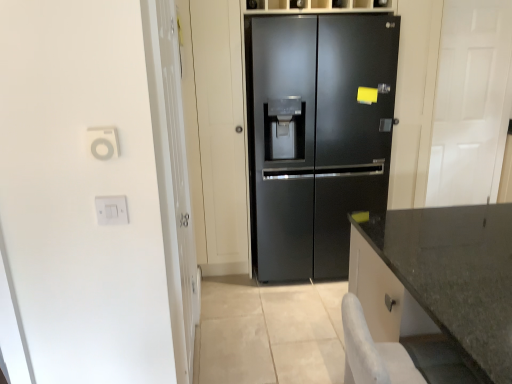
In order to face transparent glass door at left, positioned as the second glass door in back-to-front order, should I rotate leftwards or rightwards?

Turn left by 9.740 degrees to look at transparent glass door at left, positioned as the second glass door in back-to-front order.

Locate an element on the screen. This screenshot has width=512, height=384. white plastic switch at left, the second electric outlet from the top is located at coordinates (111, 210).

At what (x,y) coordinates should I click in order to perform the action: click on white plastic outlet at upper left, the 1th electric outlet from the top. Please return your answer as a coordinate pair (x, y). Looking at the image, I should click on (103, 143).

Can you tell me how much white plastic outlet at upper left, marked as the 1th electric outlet in a front-to-back arrangement, and white plastic switch at left, arranged as the 1th electric outlet when ordered from the bottom, differ in facing direction?

0.155 degrees.

Is white plastic outlet at upper left, which is counted as the 2th electric outlet, starting from the back, turned away from white plastic switch at left, the second electric outlet from the top?

No.

Is white plastic outlet at upper left, which is counted as the second electric outlet, starting from the bottom, placed right next to white plastic switch at left, placed as the first electric outlet when sorted from back to front?

white plastic outlet at upper left, which is counted as the second electric outlet, starting from the bottom, and white plastic switch at left, placed as the first electric outlet when sorted from back to front, are clearly separated.

Is white plastic outlet at upper left, which is counted as the 2th electric outlet, starting from the back, at the right side of white plastic switch at left, the second electric outlet from the top?

In fact, white plastic outlet at upper left, which is counted as the 2th electric outlet, starting from the back, is to the left of white plastic switch at left, the second electric outlet from the top.

Where is `electric outlet that is the 2nd one when counting leftward from the black matte refrigerator at center`? This screenshot has height=384, width=512. electric outlet that is the 2nd one when counting leftward from the black matte refrigerator at center is located at coordinates (103, 143).

Considering the sizes of objects white plastic outlet at upper left, the 1th electric outlet from the top, and black matte refrigerator at center in the image provided, who is shorter, white plastic outlet at upper left, the 1th electric outlet from the top, or black matte refrigerator at center?

With less height is white plastic outlet at upper left, the 1th electric outlet from the top.

Between point (116, 155) and point (343, 248), which one is positioned in front?

Positioned in front is point (116, 155).

In the scene shown: Which object is positioned more to the right, white plastic outlet at upper left, the 1th electric outlet from the top, or black matte refrigerator at center?

Positioned to the right is black matte refrigerator at center.

Consider the image. How distant is white plastic outlet at upper left, which is counted as the 2th electric outlet, starting from the back, from transparent glass door at left, which is the first glass door from front to back?

white plastic outlet at upper left, which is counted as the 2th electric outlet, starting from the back, and transparent glass door at left, which is the first glass door from front to back, are 32.80 inches apart from each other.

Is white plastic outlet at upper left, the 1th electric outlet from the top, looking in the opposite direction of transparent glass door at left, positioned as the second glass door in back-to-front order?

Correct, white plastic outlet at upper left, the 1th electric outlet from the top, is looking away from transparent glass door at left, positioned as the second glass door in back-to-front order.

Which is behind, point (98, 150) or point (160, 191)?

The point (160, 191) is more distant.

Looking at this image, is black matte refrigerator at center at the left side of granite gray countertop at lower right?

Yes, black matte refrigerator at center is to the left of granite gray countertop at lower right.

Is black matte refrigerator at center situated inside granite gray countertop at lower right or outside?

black matte refrigerator at center is outside granite gray countertop at lower right.

How different are the orientations of black matte refrigerator at center and granite gray countertop at lower right in degrees?

The angular difference between black matte refrigerator at center and granite gray countertop at lower right is 89.3 degrees.

Between black matte refrigerator at center and granite gray countertop at lower right, which one is positioned in front?

granite gray countertop at lower right.

Can you confirm if granite gray countertop at lower right is wider than transparent glass door at left, which appears as the 2th glass door when viewed from the right?

Yes.

Is granite gray countertop at lower right far away from transparent glass door at left, positioned as the second glass door in back-to-front order?

Yes, granite gray countertop at lower right and transparent glass door at left, positioned as the second glass door in back-to-front order, are located far from each other.

Starting from the granite gray countertop at lower right, which glass door is the 1st one behind? Please provide its 2D coordinates.

[(176, 189)]

Considering the sizes of objects granite gray countertop at lower right and transparent glass door at left, which is the first glass door from front to back, in the image provided, who is shorter, granite gray countertop at lower right or transparent glass door at left, which is the first glass door from front to back,?

granite gray countertop at lower right is shorter.

Does black matte refrigerator at center turn towards white plastic switch at left, placed as the first electric outlet when sorted from back to front?

No, black matte refrigerator at center is not turned towards white plastic switch at left, placed as the first electric outlet when sorted from back to front.

Is black matte refrigerator at center not near white plastic switch at left, the second electric outlet from the top?

black matte refrigerator at center is positioned a significant distance from white plastic switch at left, the second electric outlet from the top.

Which object is wider, black matte refrigerator at center or white plastic switch at left, placed as the first electric outlet when sorted from back to front?

Wider between the two is black matte refrigerator at center.

Is transparent glass door at left, positioned as the second glass door in back-to-front order, oriented towards white plastic switch at left, arranged as the second electric outlet when viewed from the front?

No, transparent glass door at left, positioned as the second glass door in back-to-front order, is not facing towards white plastic switch at left, arranged as the second electric outlet when viewed from the front.

Who is smaller, transparent glass door at left, which appears as the 2th glass door when viewed from the right, or white plastic switch at left, arranged as the second electric outlet when viewed from the front?

white plastic switch at left, arranged as the second electric outlet when viewed from the front.

In the scene shown: How different are the orientations of transparent glass door at left, positioned as the 1th glass door in left-to-right order, and white plastic switch at left, arranged as the second electric outlet when viewed from the front, in degrees?

There is a 90.8-degree angle between the facing directions of transparent glass door at left, positioned as the 1th glass door in left-to-right order, and white plastic switch at left, arranged as the second electric outlet when viewed from the front.

From a real-world perspective, is transparent glass door at left, positioned as the 1th glass door in left-to-right order, physically below white plastic switch at left, placed as the first electric outlet when sorted from back to front?

Indeed, from a real-world perspective, transparent glass door at left, positioned as the 1th glass door in left-to-right order, is positioned beneath white plastic switch at left, placed as the first electric outlet when sorted from back to front.

This screenshot has height=384, width=512. In the image, there is a white plastic switch at left, the second electric outlet from the top. What are the coordinates of `electric outlet above it (from the image's perspective)` in the screenshot? It's located at coord(103,143).

Where is `electric outlet that is the 2nd object located in front of the black matte refrigerator at center`? The image size is (512, 384). electric outlet that is the 2nd object located in front of the black matte refrigerator at center is located at coordinates [x=103, y=143].

Looking at the image, which one is located further to transparent glass door at left, which is the first glass door from front to back, white glossy door at right, arranged as the first glass door when viewed from the back, or granite gray countertop at lower right?

white glossy door at right, arranged as the first glass door when viewed from the back, is further to transparent glass door at left, which is the first glass door from front to back.

From the image, which object appears to be nearer to granite gray countertop at lower right, white glossy door at right, the 1th glass door in the right-to-left sequence, or black matte refrigerator at center?

black matte refrigerator at center is positioned closer to the anchor granite gray countertop at lower right.

Estimate the real-world distances between objects in this image. Which object is further from black matte refrigerator at center, white glossy door at right, the 1th glass door in the right-to-left sequence, or transparent glass door at left, positioned as the second glass door in back-to-front order?

white glossy door at right, the 1th glass door in the right-to-left sequence, is positioned further to the anchor black matte refrigerator at center.

In the scene shown: From the image, which object appears to be farther from white plastic switch at left, placed as the first electric outlet when sorted from back to front, white glossy door at right, the 1th glass door in the right-to-left sequence, or white plastic outlet at upper left, which is counted as the second electric outlet, starting from the bottom?

The object further to white plastic switch at left, placed as the first electric outlet when sorted from back to front, is white glossy door at right, the 1th glass door in the right-to-left sequence.

Estimate the real-world distances between objects in this image. Which object is closer to granite gray countertop at lower right, transparent glass door at left, positioned as the second glass door in back-to-front order, or white plastic outlet at upper left, which is counted as the second electric outlet, starting from the bottom?

The object closer to granite gray countertop at lower right is transparent glass door at left, positioned as the second glass door in back-to-front order.

From the picture: Considering their positions, is black matte refrigerator at center positioned closer to white plastic outlet at upper left, which is counted as the second electric outlet, starting from the bottom, than granite gray countertop at lower right?

The object closer to white plastic outlet at upper left, which is counted as the second electric outlet, starting from the bottom, is granite gray countertop at lower right.

Estimate the real-world distances between objects in this image. Which object is closer to white glossy door at right, the second glass door viewed from the front, granite gray countertop at lower right or white plastic outlet at upper left, which is counted as the 2th electric outlet, starting from the back?

granite gray countertop at lower right is positioned closer to the anchor white glossy door at right, the second glass door viewed from the front.

When comparing their distances from white plastic outlet at upper left, the 1th electric outlet from the top, does white glossy door at right, arranged as the first glass door when viewed from the back, or granite gray countertop at lower right seem closer?

Among the two, granite gray countertop at lower right is located nearer to white plastic outlet at upper left, the 1th electric outlet from the top.

Locate an element on the screen. glass door situated between white plastic outlet at upper left, which is counted as the second electric outlet, starting from the bottom, and granite gray countertop at lower right from left to right is located at coordinates (176, 189).

The height and width of the screenshot is (384, 512). I want to click on electric outlet between white plastic outlet at upper left, marked as the 1th electric outlet in a front-to-back arrangement, and white glossy door at right, the second glass door viewed from the front, so click(111, 210).

I want to click on door between granite gray countertop at lower right and white glossy door at right, arranged as the first glass door when viewed from the back, from front to back, so click(x=318, y=136).

Find the location of `glass door between granite gray countertop at lower right and black matte refrigerator at center along the z-axis`. glass door between granite gray countertop at lower right and black matte refrigerator at center along the z-axis is located at coordinates (176, 189).